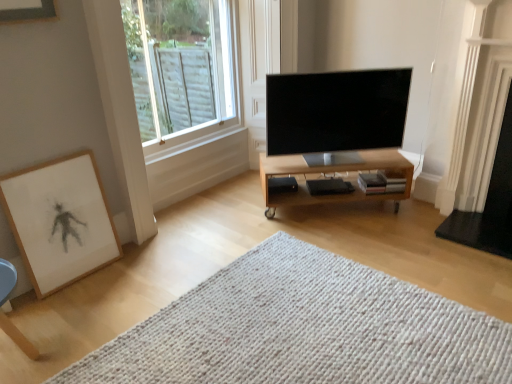
Question: Which is correct: wooden framed artwork at lower left is inside white glossy fireplace at right, or outside of it?

Choices:
 (A) inside
 (B) outside

Answer: (B)

Question: Is wooden framed artwork at lower left wider or thinner than white glossy fireplace at right?

Choices:
 (A) thin
 (B) wide

Answer: (A)

Question: Considering the real-world distances, which object is closest to the clear glass window at upper left?

Choices:
 (A) white glossy fireplace at right
 (B) matte black tv at center
 (C) light wood/finished table at center
 (D) black matte speaker at center
 (E) white knitted mat at center

Answer: (B)

Question: Estimate the real-world distances between objects in this image. Which object is closer to the white glossy fireplace at right?

Choices:
 (A) matte black tv at center
 (B) white knitted mat at center
 (C) clear glass window at upper left
 (D) wooden framed artwork at lower left
 (E) light wood/finished table at center

Answer: (E)